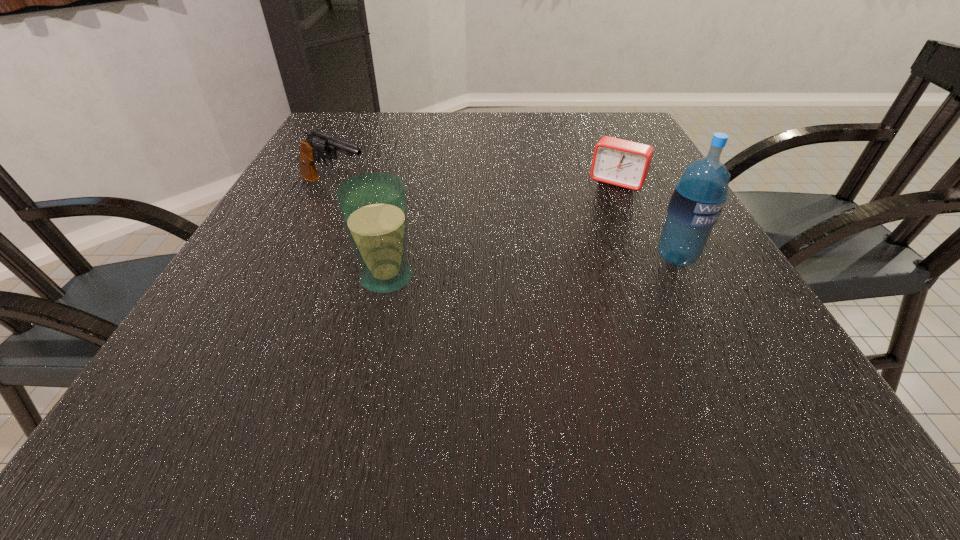
Where is `the third object from right to left`? the third object from right to left is located at coordinates (373, 206).

Find the location of `glass`. glass is located at coordinates (373, 206).

Locate an element on the screen. The height and width of the screenshot is (540, 960). water bottle is located at coordinates (698, 197).

Identify the location of the shortest object. (618, 162).

The image size is (960, 540). Identify the location of the leftmost object. (318, 144).

Locate an element on the screen. The image size is (960, 540). the second shortest object is located at coordinates (318, 144).

Locate an element on the screen. This screenshot has width=960, height=540. vacant area located on the left of the third object from right to left is located at coordinates coord(239,278).

I want to click on vacant space located on the front of the tallest object, so click(698, 299).

Where is `free space located 0.340m on the front-facing side of the alarm clock`? The width and height of the screenshot is (960, 540). free space located 0.340m on the front-facing side of the alarm clock is located at coordinates (550, 280).

You are a GUI agent. You are given a task and a screenshot of the screen. Output one action in this format:
    pyautogui.click(x=<x>, y=<y>)
    Task: Click on the free space located on the front-facing side of the alarm clock
    Image resolution: width=960 pixels, height=540 pixels.
    Given the screenshot: What is the action you would take?
    pyautogui.click(x=581, y=233)